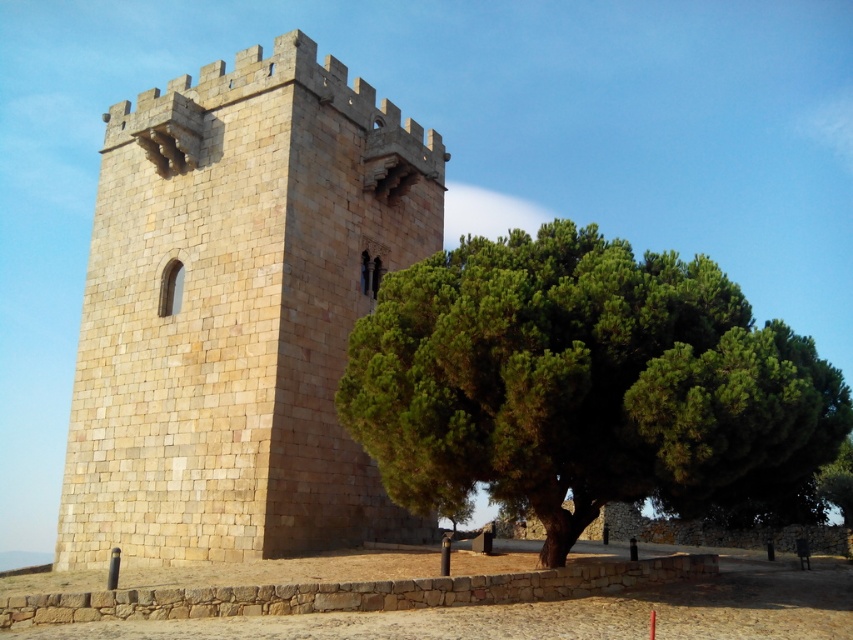
Question: Which object is closer to the camera taking this photo?

Choices:
 (A) beige stone tower at center
 (B) green leafy tree at center

Answer: (B)

Question: Does beige stone tower at center lie in front of green leafy tree at center?

Choices:
 (A) no
 (B) yes

Answer: (A)

Question: Can you confirm if beige stone tower at center is smaller than green leafy tree at center?

Choices:
 (A) yes
 (B) no

Answer: (A)

Question: Can you confirm if beige stone tower at center is wider than green leafy tree at center?

Choices:
 (A) yes
 (B) no

Answer: (B)